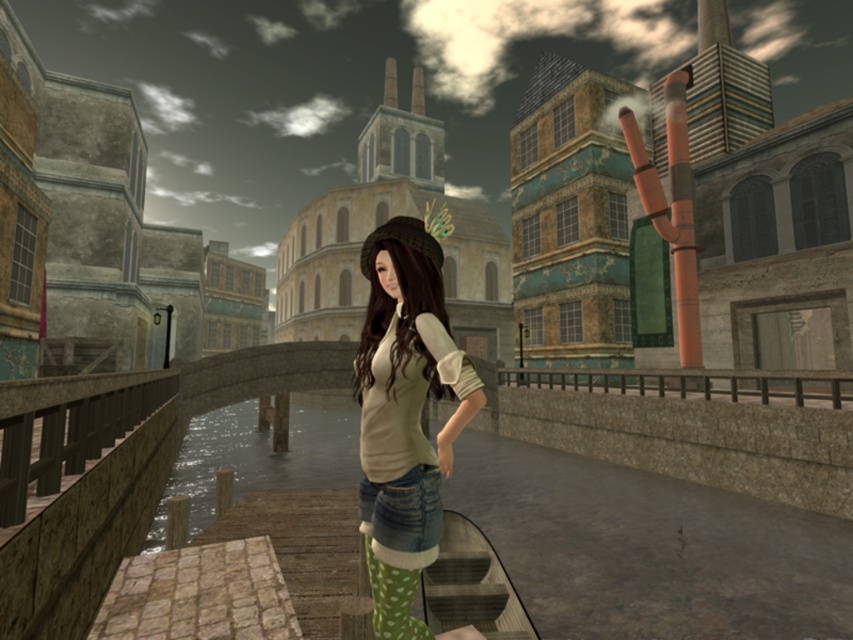
Question: Considering the real-world distances, which object is farthest from the clear water at dock center?

Choices:
 (A) brown wooden rail at right
 (B) matte green boots at center

Answer: (B)

Question: Based on their relative distances, which object is nearer to the brown wooden rail at right?

Choices:
 (A) clear water at dock center
 (B) matte green boots at center

Answer: (A)

Question: Which point is closer to the camera?

Choices:
 (A) (415, 317)
 (B) (813, 397)
 (C) (210, 429)

Answer: (A)

Question: Is matte green boots at center to the left of brown wooden rail at right from the viewer's perspective?

Choices:
 (A) yes
 (B) no

Answer: (A)

Question: Is matte green boots at center to the left of clear water at dock center from the viewer's perspective?

Choices:
 (A) no
 (B) yes

Answer: (A)

Question: Is matte green boots at center further to camera compared to clear water at dock center?

Choices:
 (A) no
 (B) yes

Answer: (A)